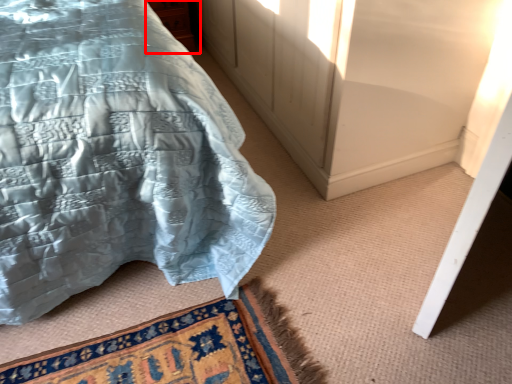
Question: In this image, where is cabinetry (annotated by the red box) located relative to bed?

Choices:
 (A) left
 (B) right

Answer: (B)